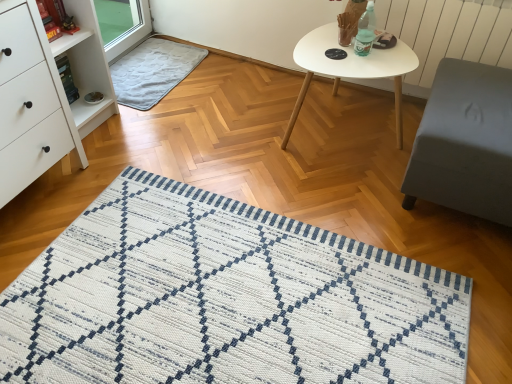
The width and height of the screenshot is (512, 384). Identify the location of free space between white matte oval table at upper center and gray soft rug at upper left. (236, 99).